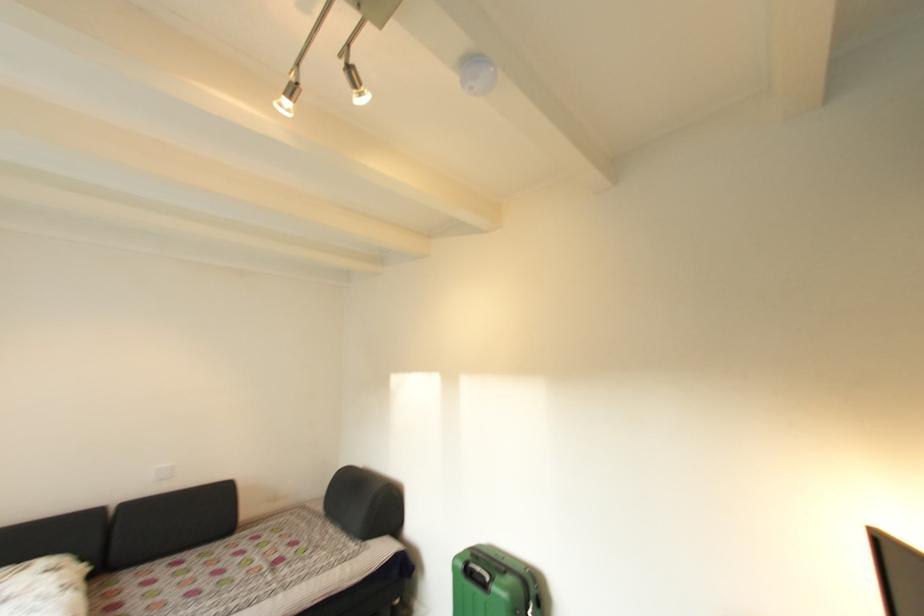
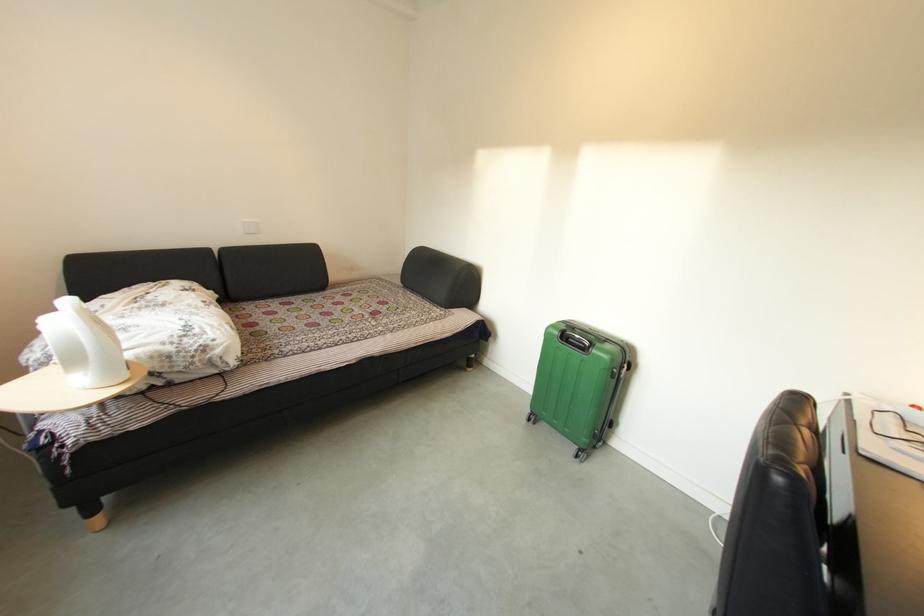
Locate, in the second image, the point that corresponds to point 103,572 in the first image.

(228, 300)